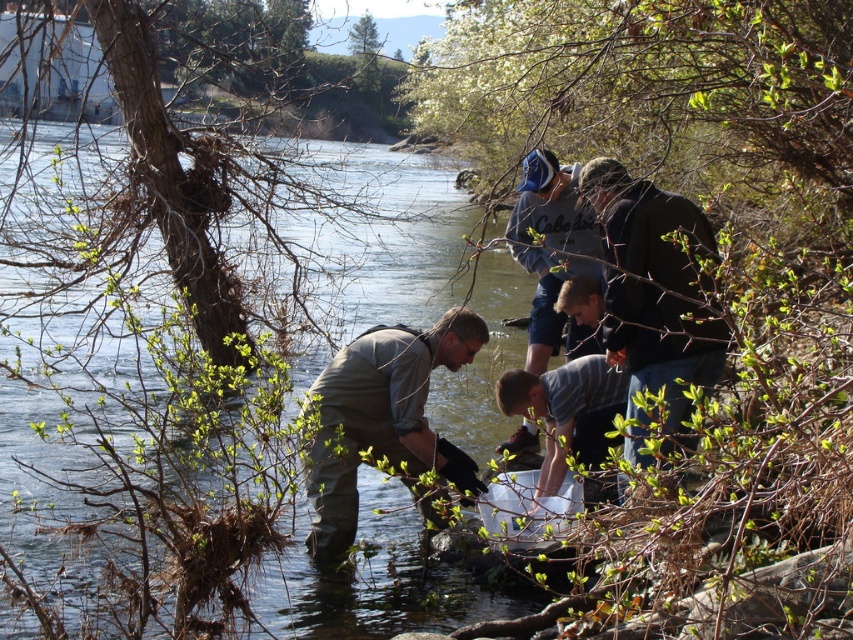
Question: Is dark brown leather jacket at upper right wider than matte gray shirt at center?

Choices:
 (A) yes
 (B) no

Answer: (B)

Question: Does dark brown leather jacket at upper right appear on the right side of blue fabric cap at upper center?

Choices:
 (A) no
 (B) yes

Answer: (B)

Question: Among these points, which one is farthest from the camera?

Choices:
 (A) (355, 438)
 (B) (599, 364)

Answer: (B)

Question: Can you confirm if matte gray shirt at center is positioned below striped cotton shirt at center?

Choices:
 (A) yes
 (B) no

Answer: (A)

Question: Which point appears closest to the camera in this image?

Choices:
 (A) (453, 332)
 (B) (693, 284)

Answer: (B)

Question: Which of the following is the farthest from the observer?

Choices:
 (A) (544, 412)
 (B) (421, 387)
 (C) (537, 268)
 (D) (643, 276)

Answer: (C)